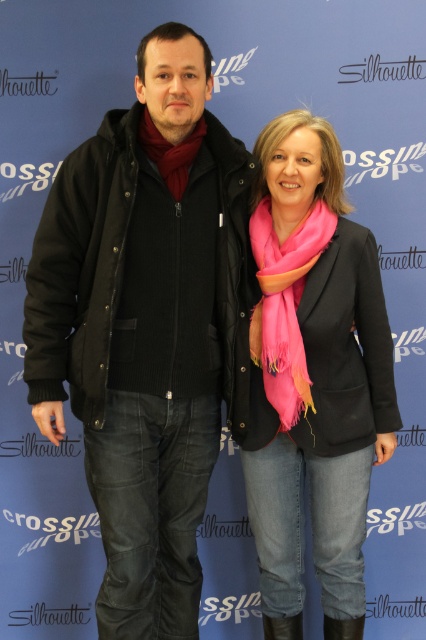
Measure the distance from black cotton jacket at left to pink scarf at center.

black cotton jacket at left and pink scarf at center are 28.71 centimeters apart from each other.

Locate an element on the screen. This screenshot has width=426, height=640. black cotton jacket at left is located at coordinates point(138,333).

What do you see at coordinates (138, 333) in the screenshot?
I see `black cotton jacket at left` at bounding box center [138, 333].

You are a GUI agent. You are given a task and a screenshot of the screen. Output one action in this format:
    pyautogui.click(x=<x>, y=<y>)
    Task: Click on the black cotton jacket at left
    
    Given the screenshot: What is the action you would take?
    pyautogui.click(x=138, y=333)

Between point (287, 250) and point (336, 632), which one is positioned behind?

Point (336, 632)

Can you confirm if pink soft scarf at center is shorter than black leather boot at lower right?

No, pink soft scarf at center is not shorter than black leather boot at lower right.

Which is in front, point (287, 252) or point (331, 620)?

Point (287, 252) is in front.

Where is `pink soft scarf at center`? pink soft scarf at center is located at coordinates (284, 305).

Is point (344, 388) farther from camera compared to point (345, 621)?

No, (344, 388) is closer to viewer.

Identify the location of pink scarf at center. (311, 369).

This screenshot has height=640, width=426. Describe the element at coordinates (311, 369) in the screenshot. I see `pink scarf at center` at that location.

I want to click on pink scarf at center, so click(x=311, y=369).